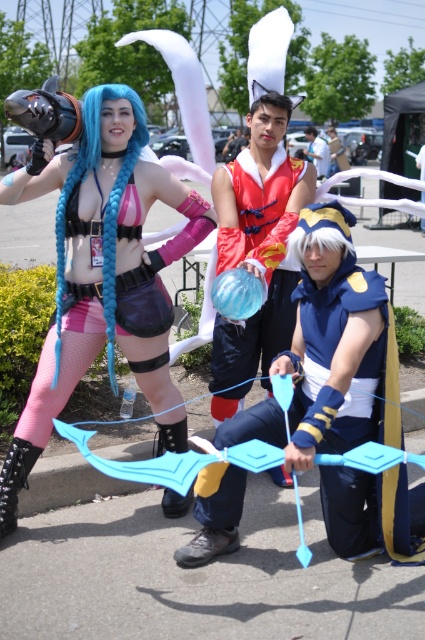
You are standing in front of the three cosplayers and want to take a photo. If you focus your camera on point 1 at point (x=50, y=147), will point 2 at point (x=303, y=188) be in focus? Please explain based on their positions.

Since point 1 at point (x=50, y=147) is closer to the viewer than point 2 at point (x=303, y=188), focusing on point 1 may not ensure point 2 is in focus. The distance between them could be beyond the camera lens depth of field, so you might need to adjust focus or position to capture both clearly.

In the scene shown: Based on the scene description, which object is positioned to the left of the other between the matte blue hair at center and the blue fabric bow at center?

The matte blue hair at center is positioned to the left of the blue fabric bow at center.